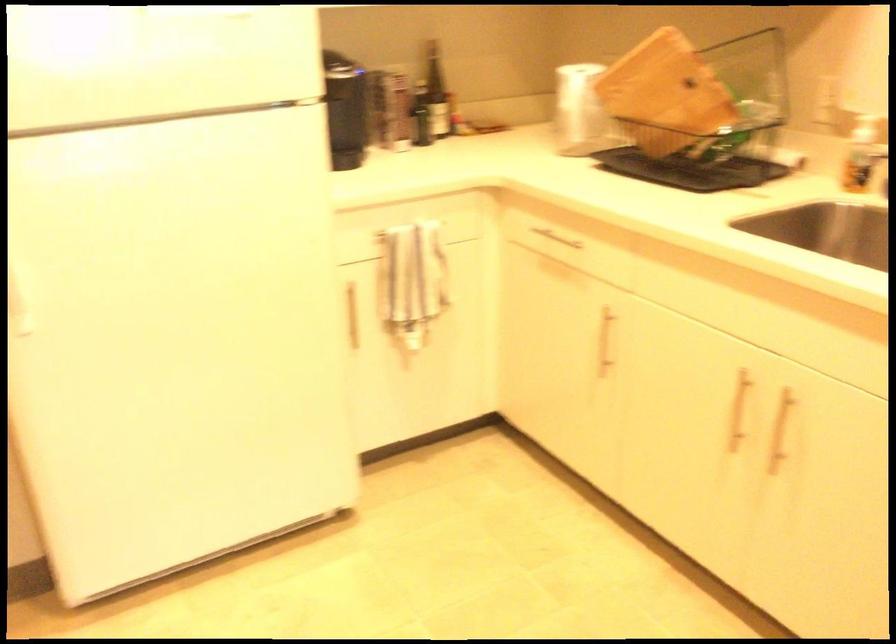
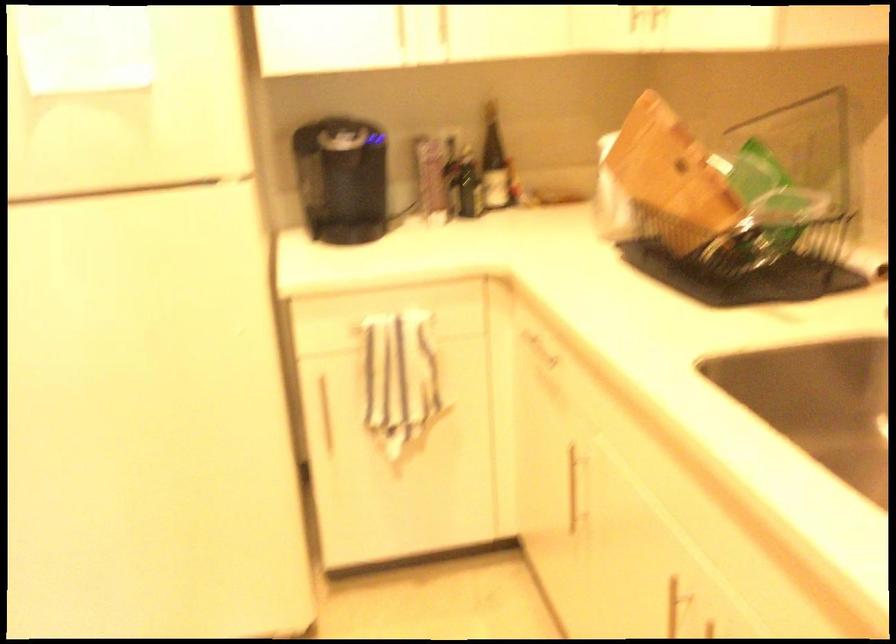
What movement of the cameraman would produce the second image?

The movement direction of the cameraman is right, forward.